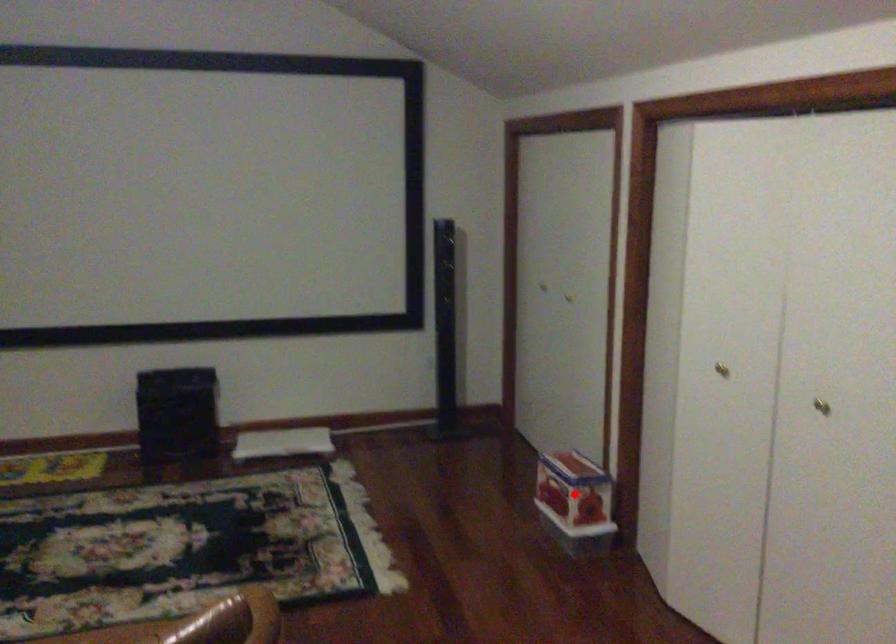
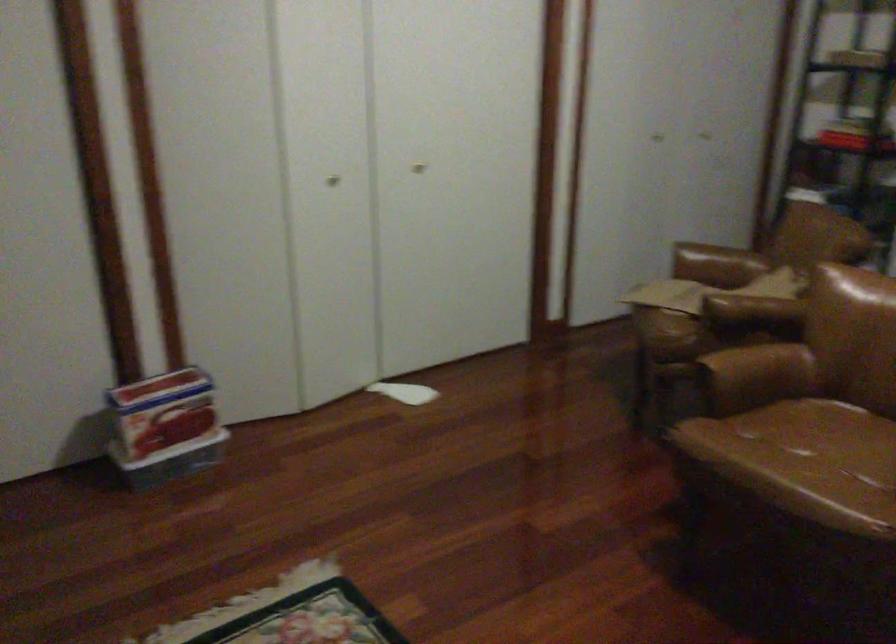
In the second image, find the point that corresponds to the highlighted location in the first image.

(218, 390)